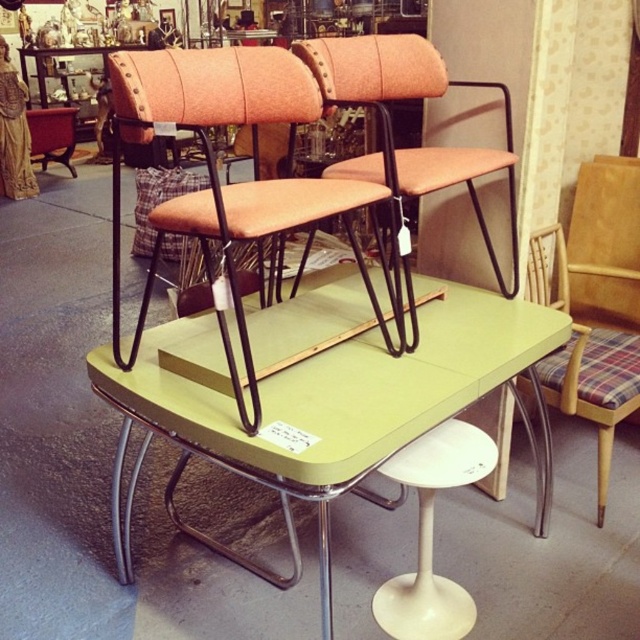
Between green laminate table at center and orange fabric chair at center, which one is positioned higher?

orange fabric chair at center is higher up.

Is green laminate table at center shorter than orange fabric chair at center?

No, green laminate table at center is not shorter than orange fabric chair at center.

Does point (234, 444) lie behind point (392, 352)?

No, (234, 444) is in front of (392, 352).

In order to click on green laminate table at center in this screenshot , I will do `click(330, 401)`.

Can you confirm if green laminate table at center is wider than white plastic stool at lower center?

Correct, the width of green laminate table at center exceeds that of white plastic stool at lower center.

Looking at this image, can you confirm if green laminate table at center is taller than white plastic stool at lower center?

Yes, green laminate table at center is taller than white plastic stool at lower center.

At what (x,y) coordinates should I click in order to perform the action: click on green laminate table at center. Please return your answer as a coordinate pair (x, y). This screenshot has height=640, width=640. Looking at the image, I should click on (330, 401).

I want to click on green laminate table at center, so click(330, 401).

Looking at this image, which of these two, green laminate table at center or plaid fabric folding chair at right, stands shorter?

Standing shorter between the two is green laminate table at center.

Does green laminate table at center lie in front of plaid fabric folding chair at right?

Yes, green laminate table at center is closer to the viewer.

This screenshot has height=640, width=640. Identify the location of green laminate table at center. (330, 401).